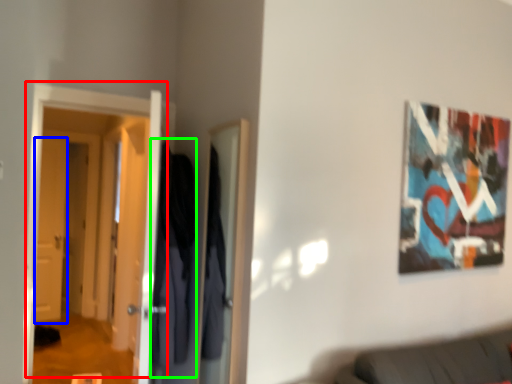
Question: Which object is the closest to the door (highlighted by a red box)? Choose among these: door (highlighted by a blue box) or robe (highlighted by a green box).

Choices:
 (A) door
 (B) robe

Answer: (B)